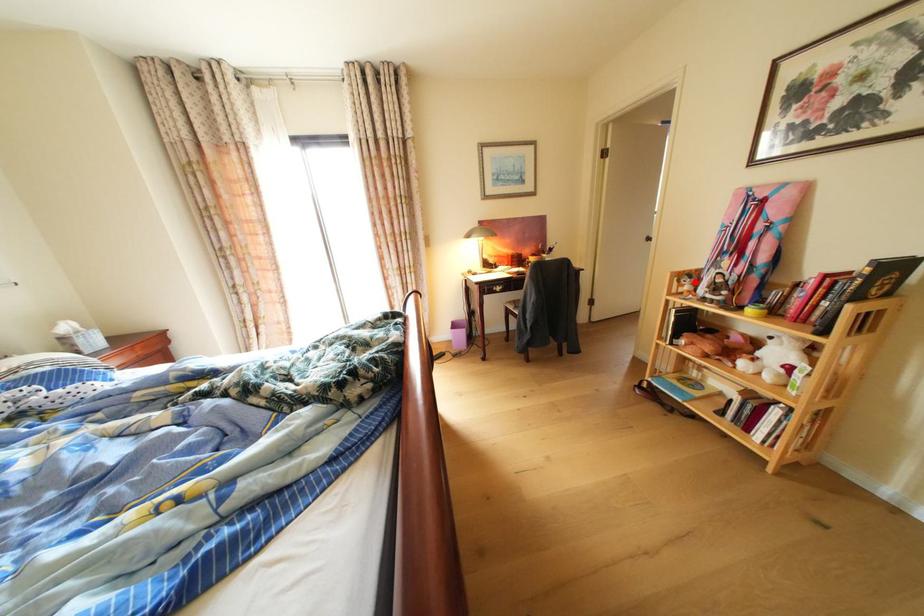
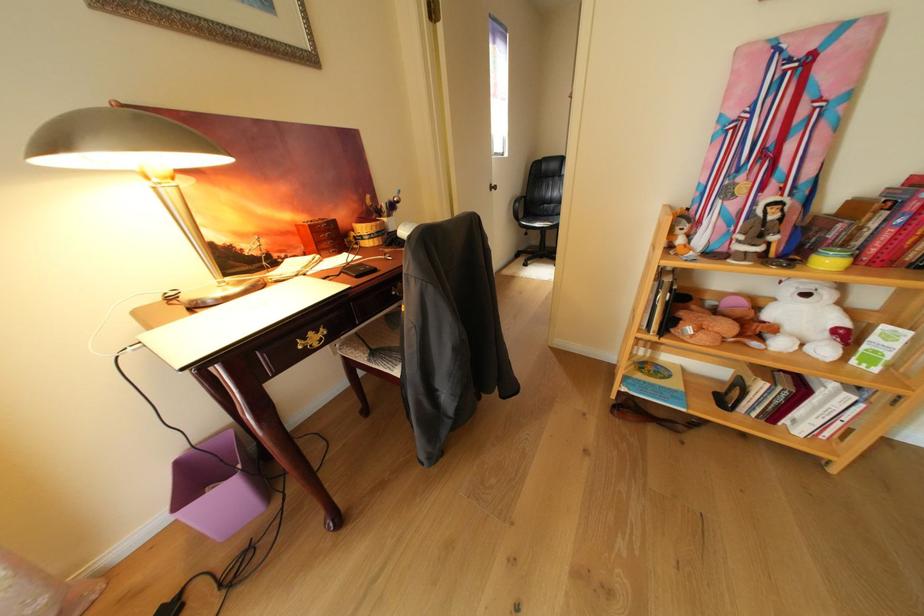
The point at the highlighted location is marked in the first image. Where is the corresponding point in the second image?

(689, 230)